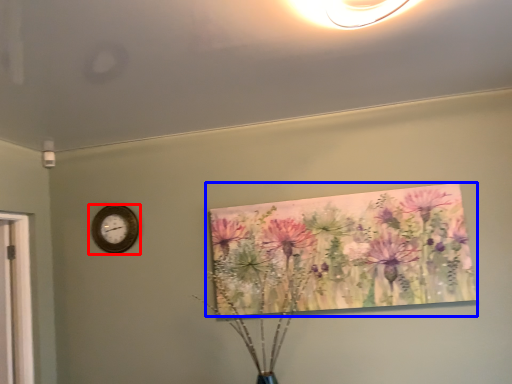
Question: Which point is further to the camera, wall clock (highlighted by a red box) or floral arrangement (highlighted by a blue box)?

Choices:
 (A) wall clock
 (B) floral arrangement

Answer: (A)